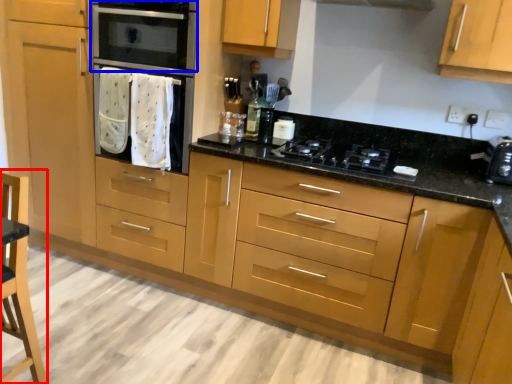
Question: Which point is closer to the camera, armchair (highlighted by a red box) or home appliance (highlighted by a blue box)?

Choices:
 (A) armchair
 (B) home appliance

Answer: (A)